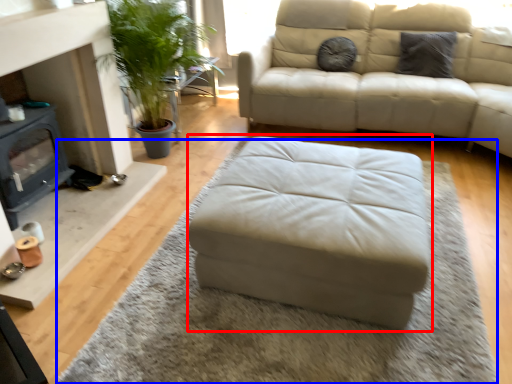
Question: Which point is closer to the camera, stool (highlighted by a red box) or mat (highlighted by a blue box)?

Choices:
 (A) stool
 (B) mat

Answer: (B)